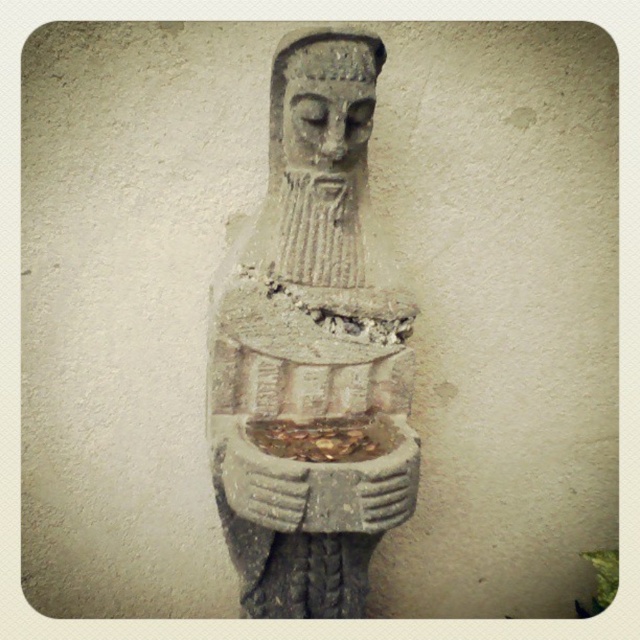
You are an architect designing a new museum exhibit. You need to place a spotlight exactly at the center of the gray stone statue at center. What are the coordinates where you should position the spotlight?

The coordinates for the center of the gray stone statue at center are at point (x=310, y=353), so you should position the spotlight at those coordinates.

You are an art conservator examining the weathered stone statue and its head. Based on their sizes, which object would require more material for restoration? Please refer to the gray stone statue at center and the gray stone head at center in your answer.

The gray stone statue at center is larger in size than the gray stone head at center, so it would require more material for restoration.